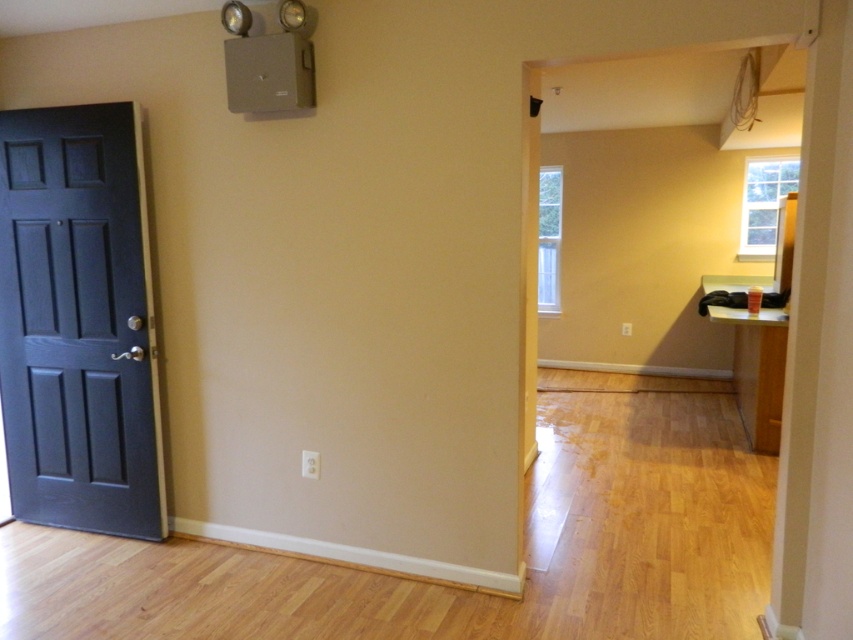
Can you confirm if matte black door at left is shorter than light brown wood table at right?

In fact, matte black door at left may be taller than light brown wood table at right.

This screenshot has height=640, width=853. Identify the location of matte black door at left. (78, 321).